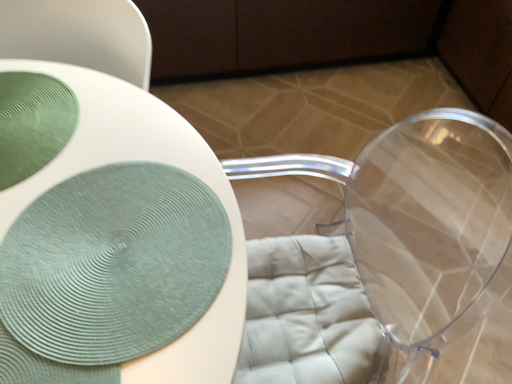
The height and width of the screenshot is (384, 512). I want to click on free point above green textured plate at upper left (from a real-world perspective), so click(x=28, y=119).